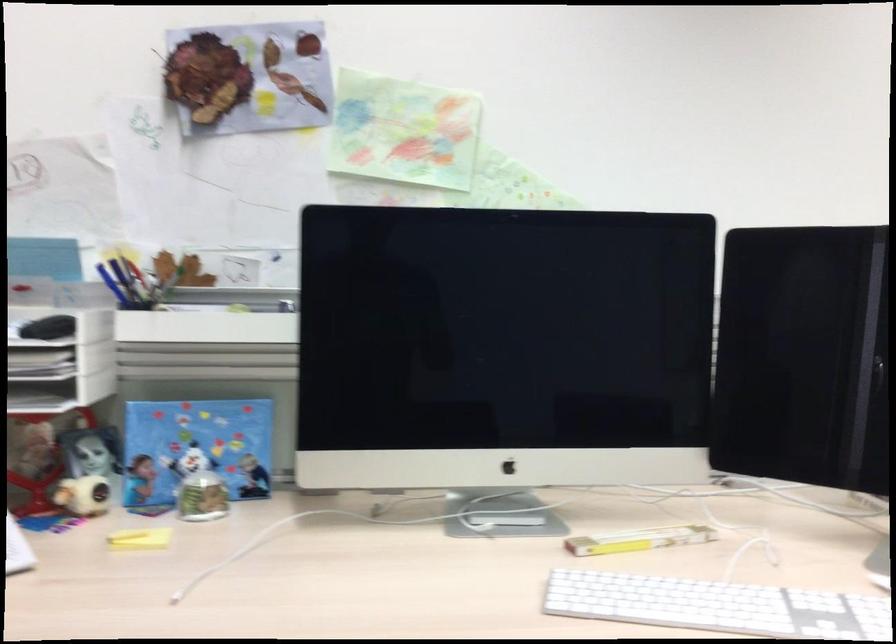
Identify the location of white keyboard. Image resolution: width=896 pixels, height=644 pixels. (717, 605).